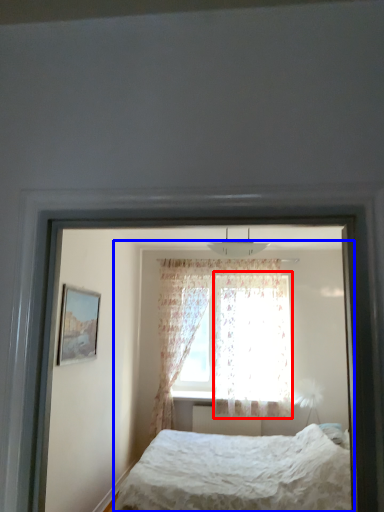
Question: Which point is further to the camera, curtain (highlighted by a red box) or bed (highlighted by a blue box)?

Choices:
 (A) curtain
 (B) bed

Answer: (A)